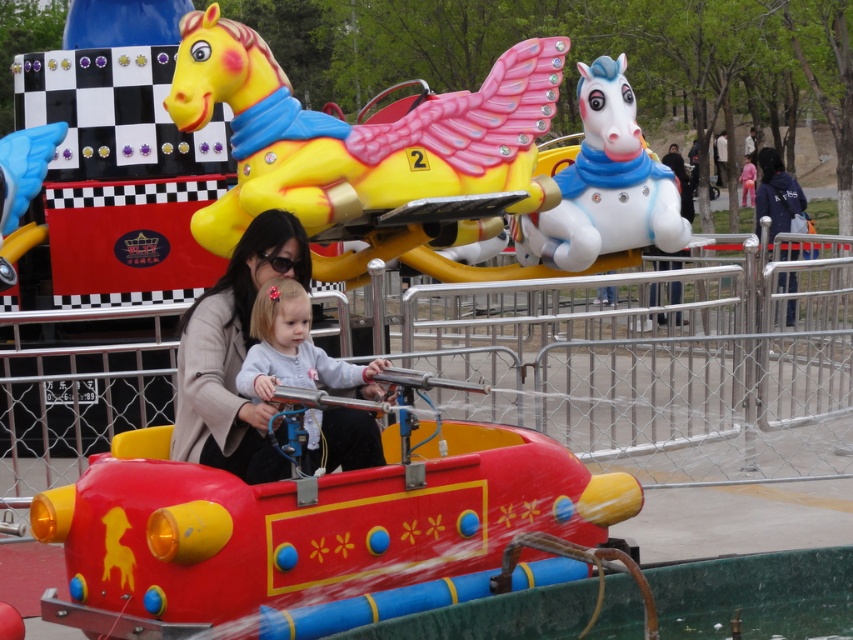
Who is positioned more to the right, shiny plastic boat at center or yellow matte plastic horse at upper center?

shiny plastic boat at center is more to the right.

What are the coordinates of `shiny plastic boat at center` in the screenshot? It's located at click(311, 531).

Is point (44, 596) positioned behind point (216, 10)?

No, (44, 596) is closer to viewer.

You are a GUI agent. You are given a task and a screenshot of the screen. Output one action in this format:
    pyautogui.click(x=<x>, y=<y>)
    Task: Click on the shiny plastic boat at center
    The width and height of the screenshot is (853, 640).
    Given the screenshot: What is the action you would take?
    pyautogui.click(x=311, y=531)

Does point (291, 156) come behind point (596, 179)?

That is False.

Is yellow matte plastic horse at upper center above white glossy horse at upper center?

Indeed, yellow matte plastic horse at upper center is positioned over white glossy horse at upper center.

The height and width of the screenshot is (640, 853). Find the location of `yellow matte plastic horse at upper center`. yellow matte plastic horse at upper center is located at coordinates (364, 148).

Consider the image. Is shiny plastic boat at center bigger than white glossy horse at upper center?

Incorrect, shiny plastic boat at center is not larger than white glossy horse at upper center.

Does shiny plastic boat at center come in front of white glossy horse at upper center?

Yes, shiny plastic boat at center is closer to the viewer.

Identify the location of shiny plastic boat at center. (311, 531).